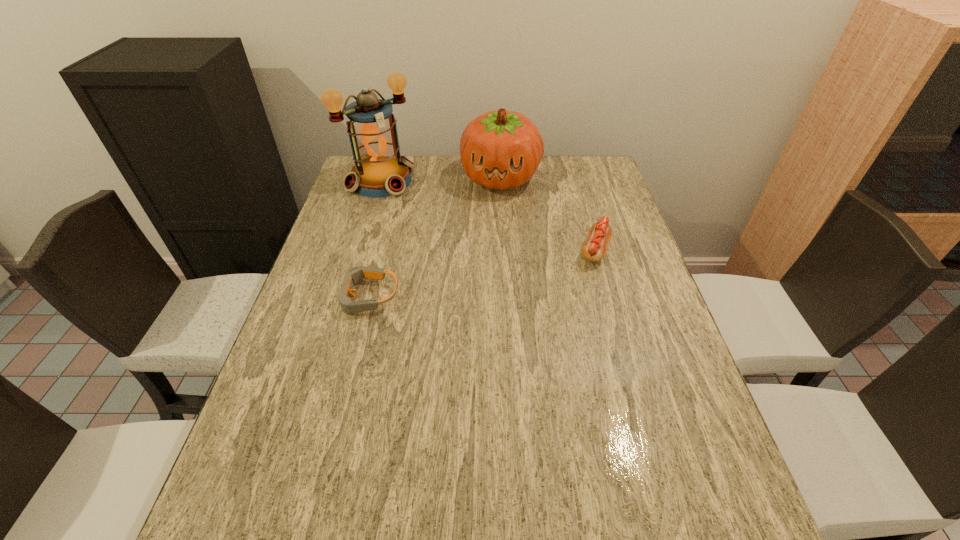
Where is `lantern at the left edge`? lantern at the left edge is located at coordinates (379, 171).

Where is `object present at the right edge`? The height and width of the screenshot is (540, 960). object present at the right edge is located at coordinates (594, 249).

Find the location of a particular element. This screenshot has width=960, height=540. object that is at the far left corner is located at coordinates (379, 171).

Find the location of a particular element. The height and width of the screenshot is (540, 960). free space at the far edge of the desktop is located at coordinates (450, 158).

This screenshot has width=960, height=540. What are the coordinates of `free region at the near edge of the desktop` in the screenshot? It's located at (488, 451).

At what (x,y) coordinates should I click in order to perform the action: click on free space at the left edge of the desktop. Please return your answer as a coordinate pair (x, y). The height and width of the screenshot is (540, 960). Looking at the image, I should click on (341, 355).

What are the coordinates of `vacant space at the right edge` in the screenshot? It's located at (625, 248).

You are a GUI agent. You are given a task and a screenshot of the screen. Output one action in this format:
    pyautogui.click(x=<x>, y=<y>)
    Task: Click on the vacant region at the near left corner of the desktop
    Image resolution: width=960 pixels, height=540 pixels.
    Given the screenshot: What is the action you would take?
    pyautogui.click(x=314, y=473)

The height and width of the screenshot is (540, 960). In the image, there is a desktop. Find the location of `vacant space at the near right corner`. vacant space at the near right corner is located at coordinates (712, 466).

Where is `vacant area that lies between the sausage and the second tallest object`? This screenshot has height=540, width=960. vacant area that lies between the sausage and the second tallest object is located at coordinates tap(548, 214).